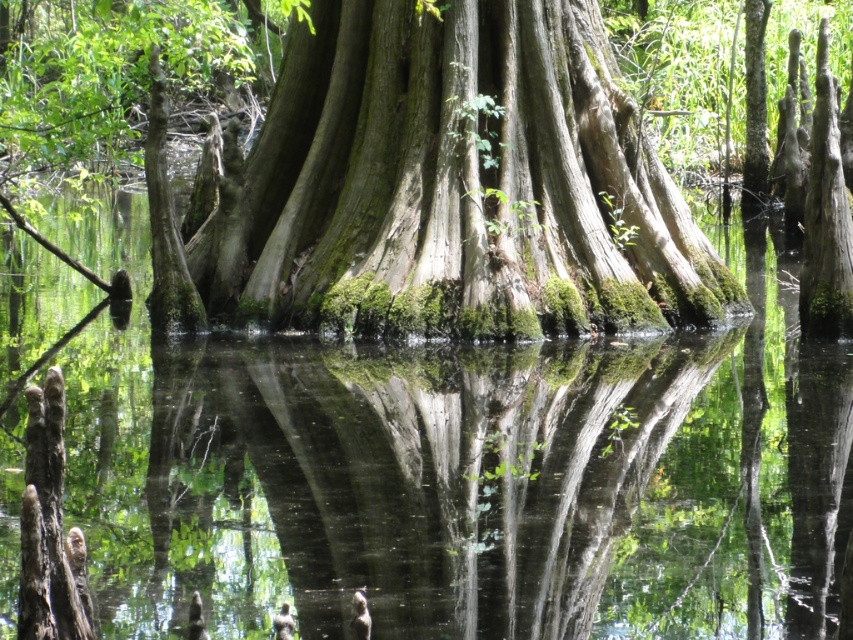
You are standing in the swamp and want to touch both the green mossy water at center and the green mossy bark at center. Which one would you reach first?

The green mossy water at center is closer to the viewer than the green mossy bark at center, so you would reach the green mossy water at center first.

You are standing in the swamp and see the green mossy water at center and the green mossy tree roots at center. Which one is higher up in the scene?

The green mossy water at center is located above the green mossy tree roots at center, so the green mossy water at center is higher up in the scene.